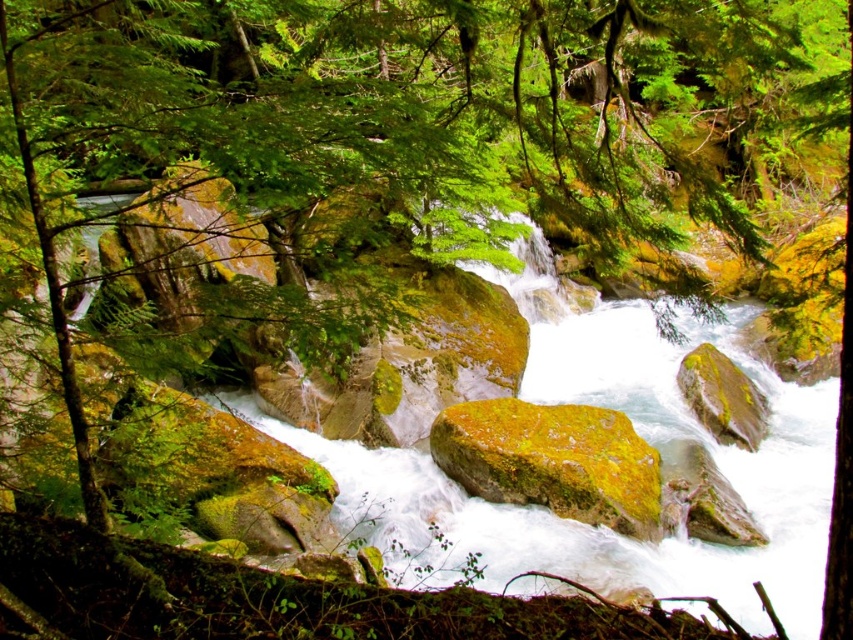
Question: Considering the relative positions of green mossy rock at center and green mossy rock at center-right in the image provided, where is green mossy rock at center located with respect to green mossy rock at center-right?

Choices:
 (A) right
 (B) left

Answer: (B)

Question: Which point appears closest to the camera in this image?

Choices:
 (A) (589, 433)
 (B) (699, 397)

Answer: (A)

Question: Which point appears closest to the camera in this image?

Choices:
 (A) (492, 412)
 (B) (727, 358)

Answer: (A)

Question: Observing the image, what is the correct spatial positioning of green mossy rock at center in reference to green mossy rock at center-right?

Choices:
 (A) left
 (B) right

Answer: (A)

Question: Is green mossy rock at center positioned behind green mossy rock at center-right?

Choices:
 (A) yes
 (B) no

Answer: (B)

Question: Which point is closer to the camera taking this photo?

Choices:
 (A) (715, 404)
 (B) (602, 422)

Answer: (B)